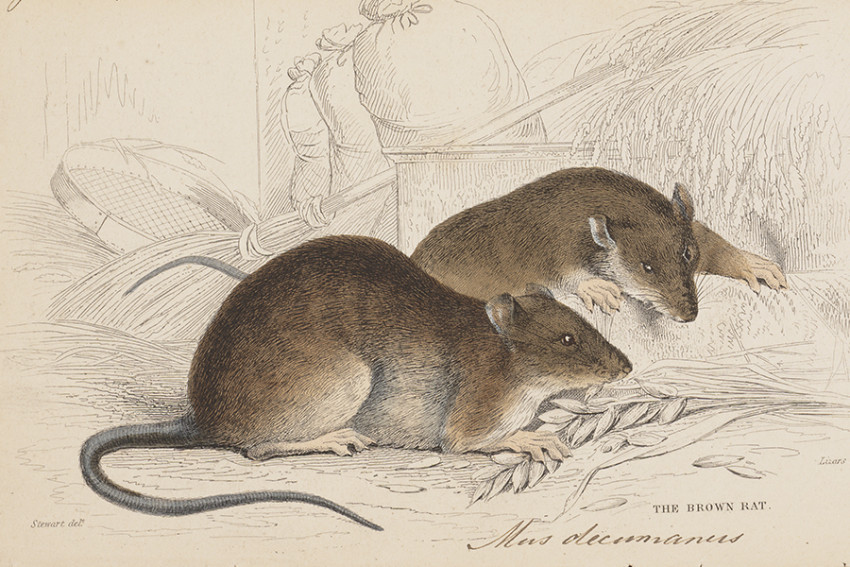
What are the coordinates of `broom` in the screenshot? It's located at (348, 191), (225, 249).